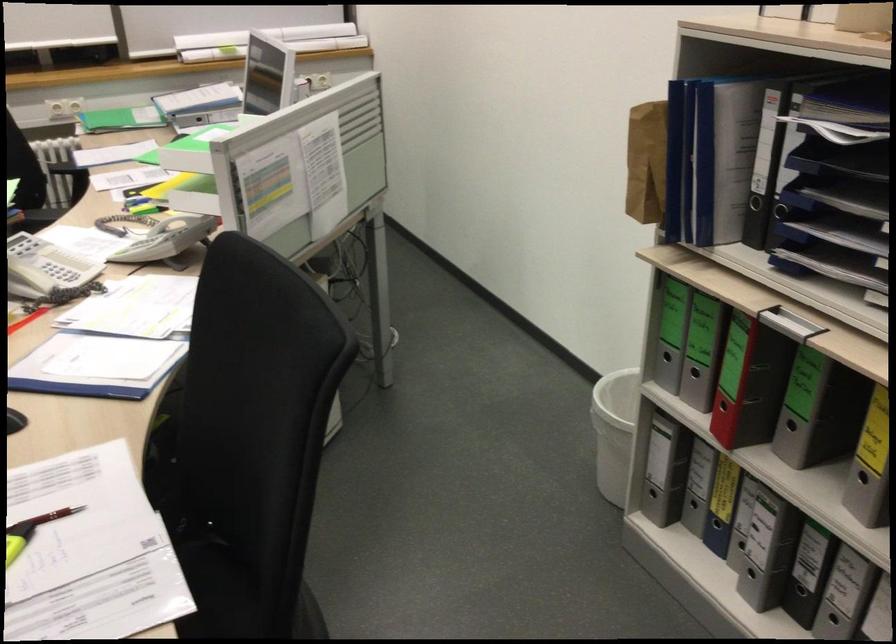
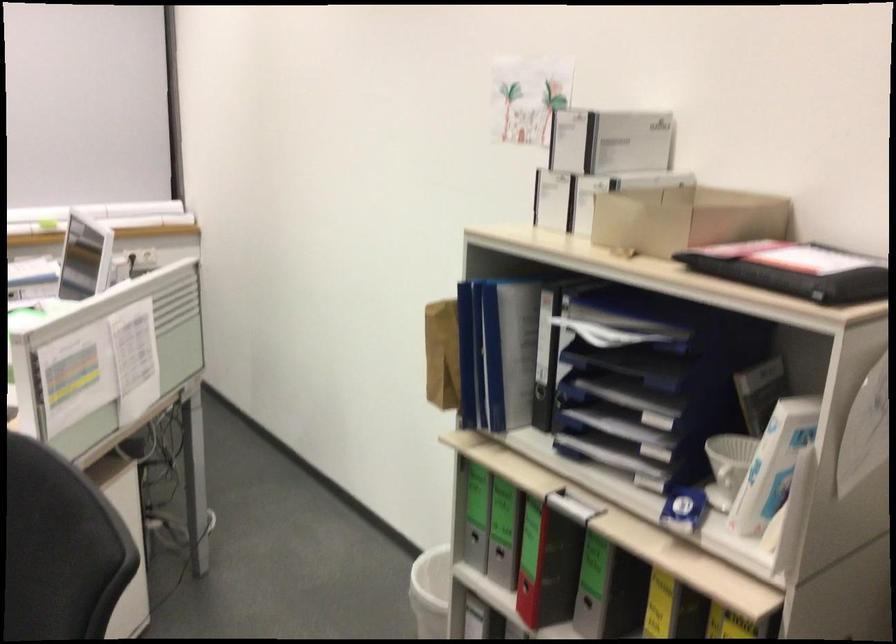
Question: How did the camera likely rotate?

Choices:
 (A) Left
 (B) Right
 (C) Up
 (D) Down

Answer: (C)